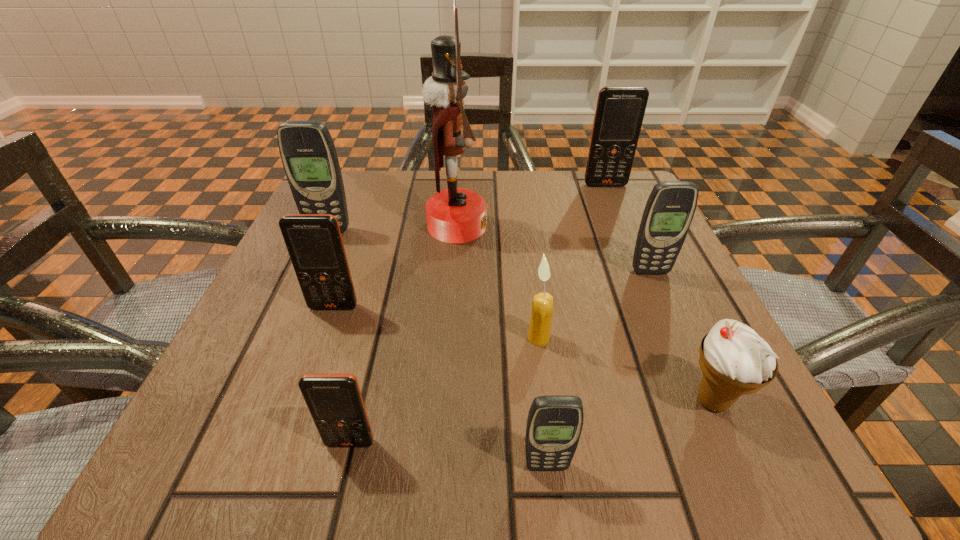
This screenshot has width=960, height=540. I want to click on free space between the third farthest cellular telephone and the third cellular telephone from left to right, so click(x=500, y=357).

I want to click on empty space that is in between the nearest cellular telephone and the white icecream, so click(630, 433).

Locate an element on the screen. This screenshot has width=960, height=540. vacant area between the third nearest object and the rightmost orange cellular telephone is located at coordinates (659, 293).

Find the location of a particular element. The height and width of the screenshot is (540, 960). free point between the smallest gray cellular telephone and the second nearest orange cellular telephone is located at coordinates (440, 387).

Locate an element on the screen. The height and width of the screenshot is (540, 960). free spot between the farthest cellular telephone and the icecream is located at coordinates (659, 293).

Image resolution: width=960 pixels, height=540 pixels. Identify the location of empty space between the second biggest orange cellular telephone and the nearest object. (440, 387).

The height and width of the screenshot is (540, 960). I want to click on free spot between the third nearest object and the nearest gray cellular telephone, so click(x=630, y=433).

In order to click on free space between the cream candle and the second nearest gray cellular telephone in this screenshot , I will do `click(594, 305)`.

Where is `object that stands as the second closest to the sixth nearest object`? object that stands as the second closest to the sixth nearest object is located at coordinates tap(735, 360).

Where is `object that can be found as the seventh closest to the red nutcracker`? This screenshot has height=540, width=960. object that can be found as the seventh closest to the red nutcracker is located at coordinates (335, 402).